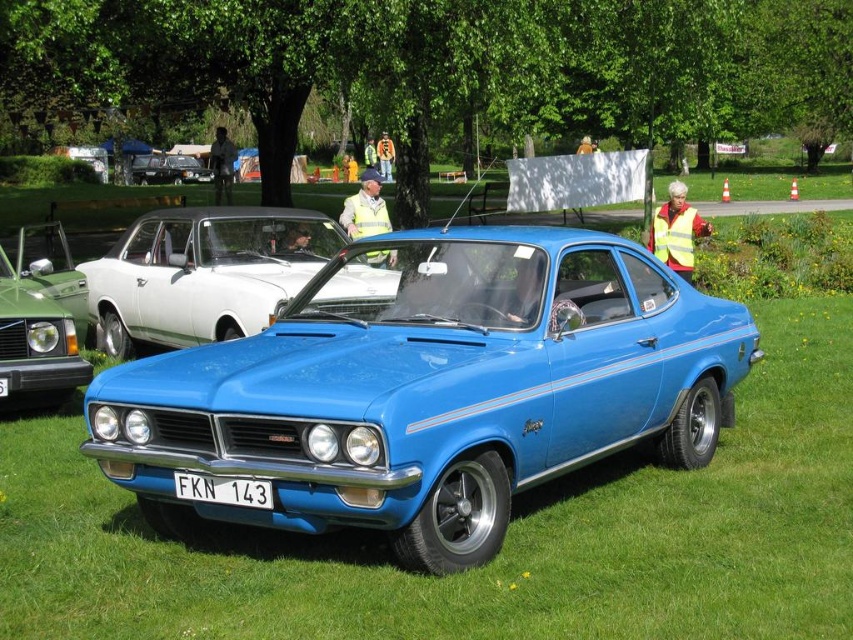
You are a photographer at a car show and want to capture both the glossy blue car at center and the shiny black car at center in a single frame. Based on their positions, which car should you focus on first to ensure both are in the shot?

The glossy blue car at center is in front of the shiny black car at center, so you should focus on the glossy blue car at center first to ensure both are in the shot.